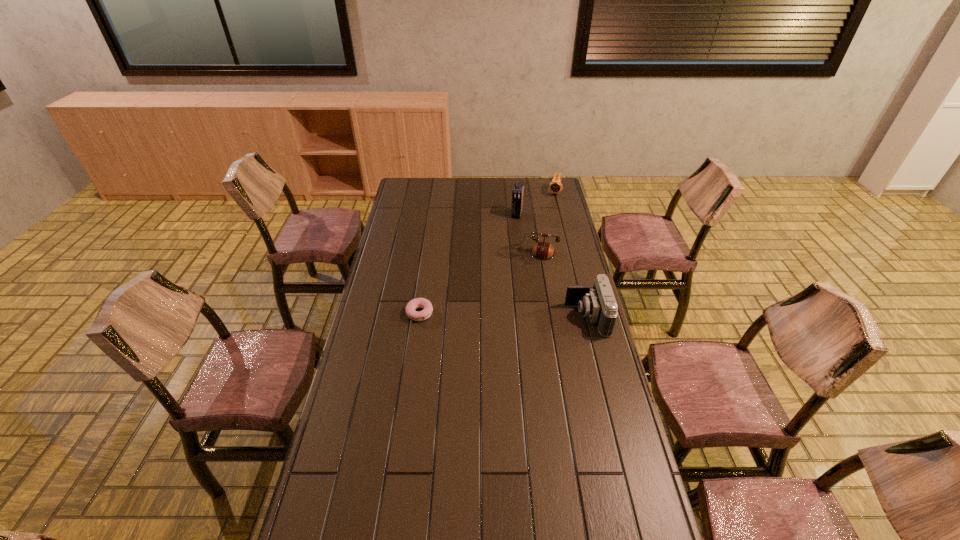
The height and width of the screenshot is (540, 960). I want to click on object that is at the far edge, so click(x=555, y=186).

In order to click on object that is at the left edge in this screenshot , I will do `click(412, 305)`.

Identify the location of camera located in the right edge section of the desktop. (597, 302).

Find the location of a particular element. The image size is (960, 540). watch present at the right edge is located at coordinates [555, 186].

Identify the location of telephone at the right edge. (542, 250).

Identify the location of object present at the far right corner. pos(555,186).

Where is `free space at the far edge of the desktop`? This screenshot has width=960, height=540. free space at the far edge of the desktop is located at coordinates (491, 181).

Identify the location of vacant space at the near edge. The width and height of the screenshot is (960, 540). (505, 511).

The image size is (960, 540). I want to click on free spot at the left edge of the desktop, so click(404, 296).

You are a GUI agent. You are given a task and a screenshot of the screen. Output one action in this format:
    pyautogui.click(x=<x>, y=<y>)
    Task: Click on the free region at the right edge of the desktop
    The image size is (960, 540).
    Given the screenshot: What is the action you would take?
    pyautogui.click(x=586, y=276)